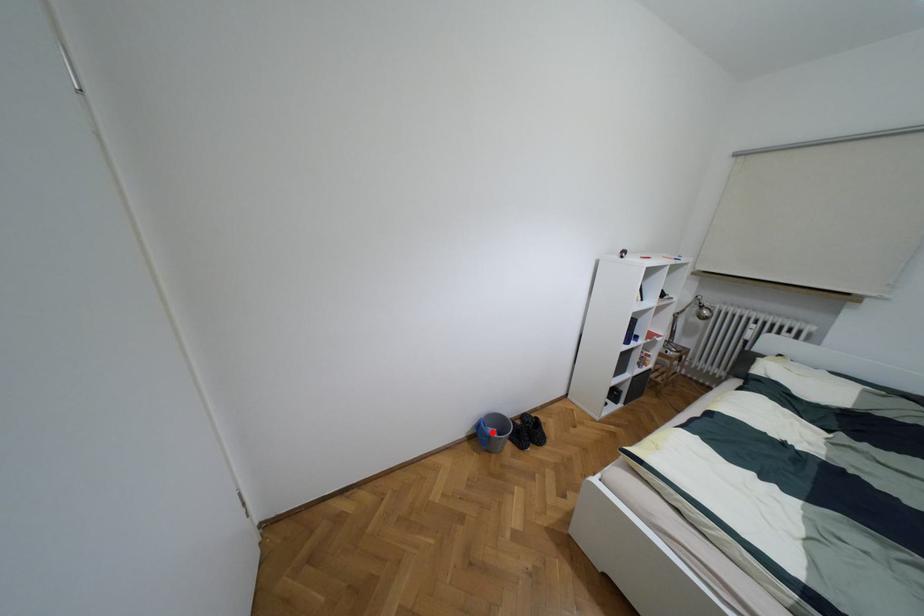
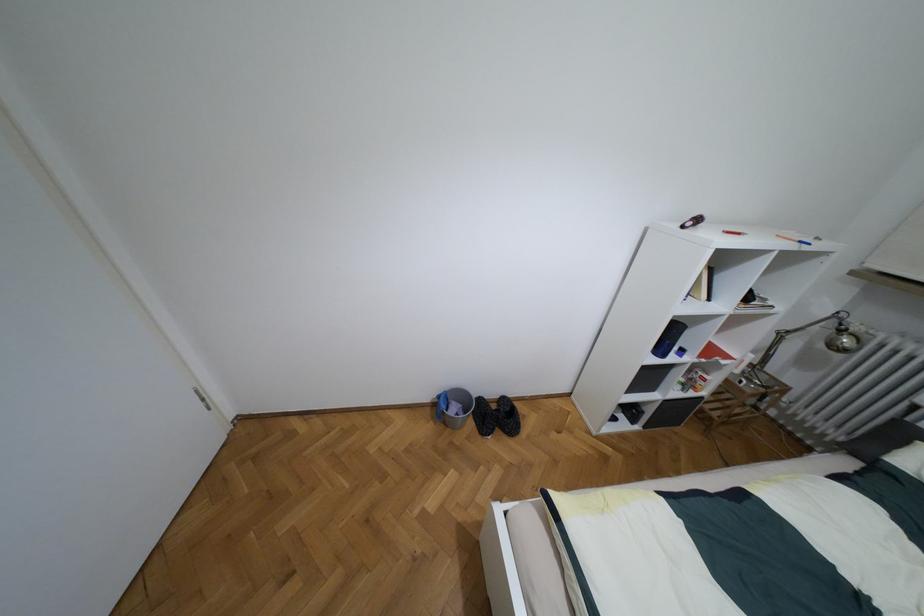
Question: I am providing you with two images of the same scene from different viewpoints. Given a red point in image1, look at the same physical point in image2. Is it:

Choices:
 (A) Closer to the viewpoint
 (B) Farther from the viewpoint

Answer: (B)